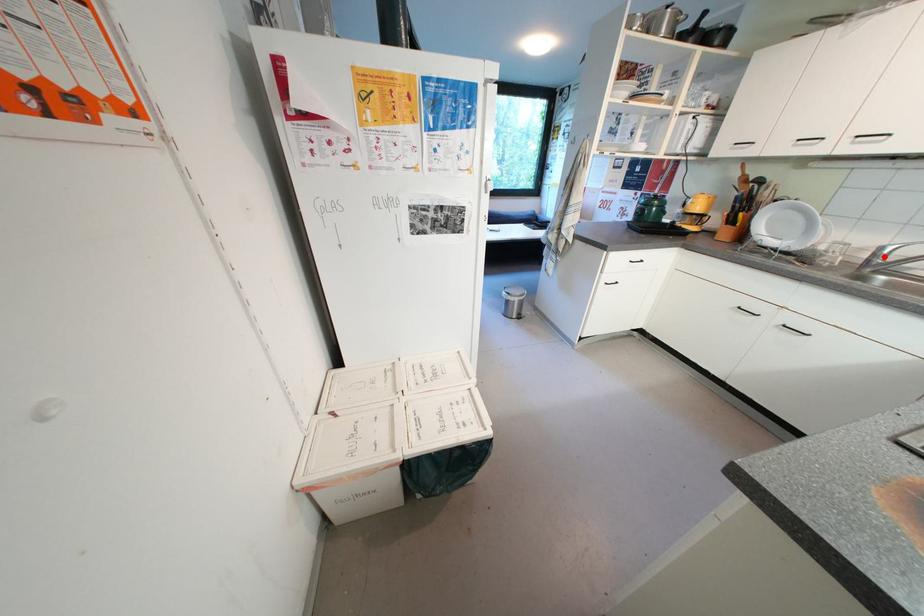
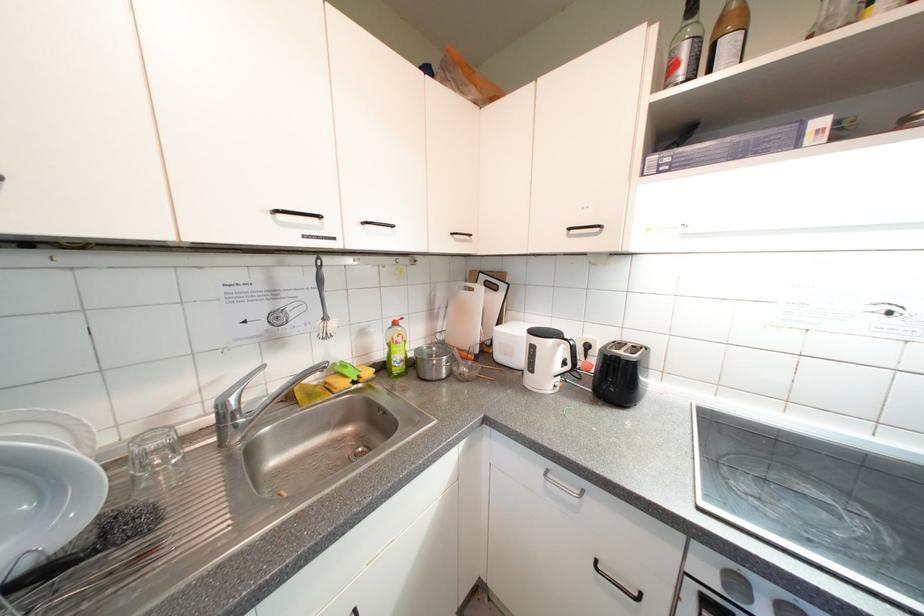
In the second image, find the point that corresponds to the highlighted location in the first image.

(233, 419)